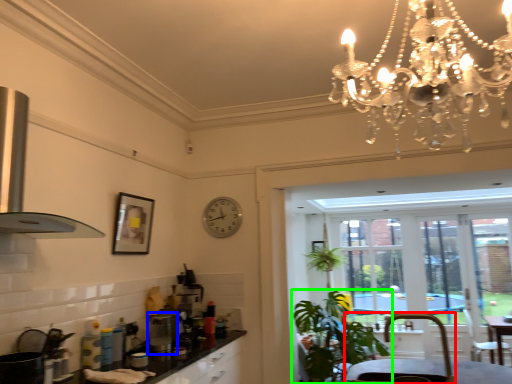
Question: Based on their relative distances, which object is nearer to armchair (highlighted by a red box)? Choose from appliance (highlighted by a blue box) and houseplant (highlighted by a green box).

Choices:
 (A) appliance
 (B) houseplant

Answer: (B)